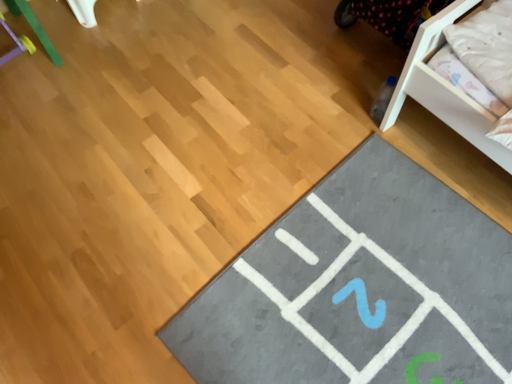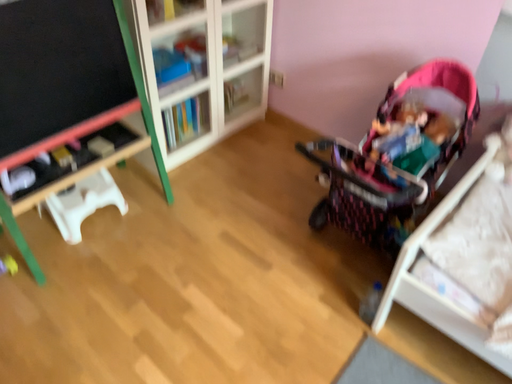
Question: Which way did the camera rotate in the video?

Choices:
 (A) rotated upward
 (B) rotated downward

Answer: (A)